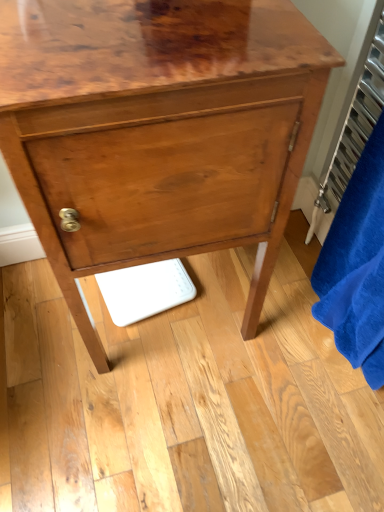
Question: From the image's perspective, is blue plush bath towel at right on metallic silver radiator at right?

Choices:
 (A) no
 (B) yes

Answer: (A)

Question: Is blue plush bath towel at right completely or partially outside of metallic silver radiator at right?

Choices:
 (A) yes
 (B) no

Answer: (A)

Question: Is blue plush bath towel at right wider than metallic silver radiator at right?

Choices:
 (A) no
 (B) yes

Answer: (B)

Question: Can you confirm if blue plush bath towel at right is bigger than metallic silver radiator at right?

Choices:
 (A) yes
 (B) no

Answer: (A)

Question: Is blue plush bath towel at right to the left of metallic silver radiator at right from the viewer's perspective?

Choices:
 (A) no
 (B) yes

Answer: (B)

Question: From a real-world perspective, is metallic silver radiator at right above or below glossy wood chest of drawers at center?

Choices:
 (A) below
 (B) above

Answer: (B)

Question: From the image's perspective, is metallic silver radiator at right located above or below glossy wood chest of drawers at center?

Choices:
 (A) below
 (B) above

Answer: (B)

Question: In the image, is metallic silver radiator at right positioned in front of or behind glossy wood chest of drawers at center?

Choices:
 (A) behind
 (B) front

Answer: (A)

Question: Is metallic silver radiator at right situated inside glossy wood chest of drawers at center or outside?

Choices:
 (A) inside
 (B) outside

Answer: (B)

Question: From a real-world perspective, is glossy wood chest of drawers at center physically located above or below metallic silver radiator at right?

Choices:
 (A) above
 (B) below

Answer: (B)

Question: Is glossy wood chest of drawers at center bigger or smaller than metallic silver radiator at right?

Choices:
 (A) big
 (B) small

Answer: (A)

Question: Is glossy wood chest of drawers at center taller or shorter than metallic silver radiator at right?

Choices:
 (A) short
 (B) tall

Answer: (B)

Question: From the image's perspective, relative to metallic silver radiator at right, is glossy wood chest of drawers at center above or below?

Choices:
 (A) above
 (B) below

Answer: (B)

Question: Considering the positions of blue plush bath towel at right and metallic silver radiator at right in the image, is blue plush bath towel at right bigger or smaller than metallic silver radiator at right?

Choices:
 (A) big
 (B) small

Answer: (A)

Question: Does point (327, 294) appear closer or farther from the camera than point (339, 173)?

Choices:
 (A) farther
 (B) closer

Answer: (B)